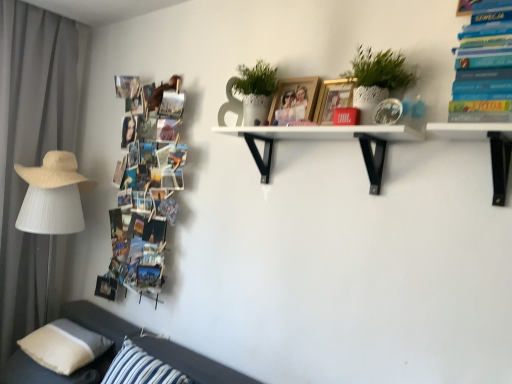
Locate an element on the screen. The width and height of the screenshot is (512, 384). vacant space situated above gray fabric curtain at left (from a real-world perspective) is located at coordinates (48, 9).